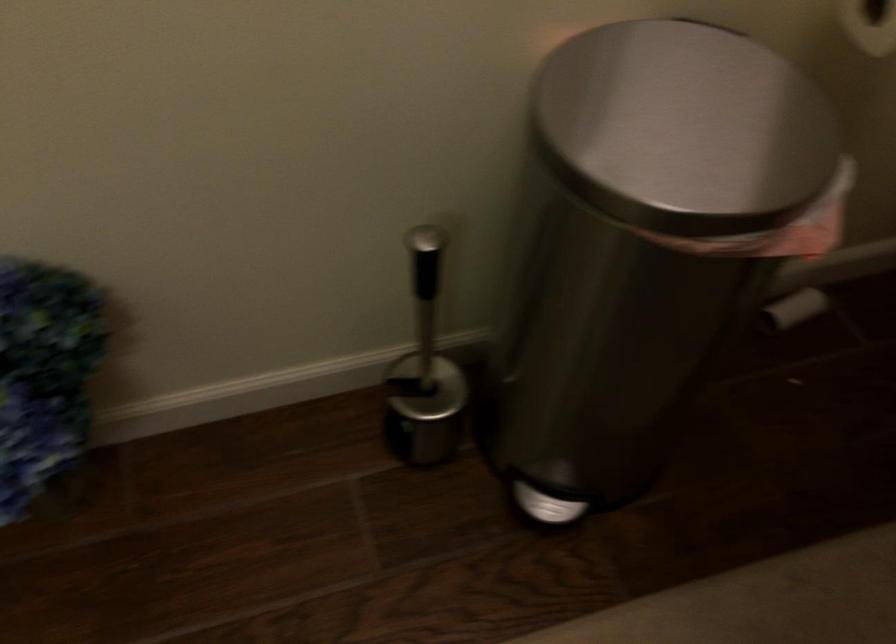
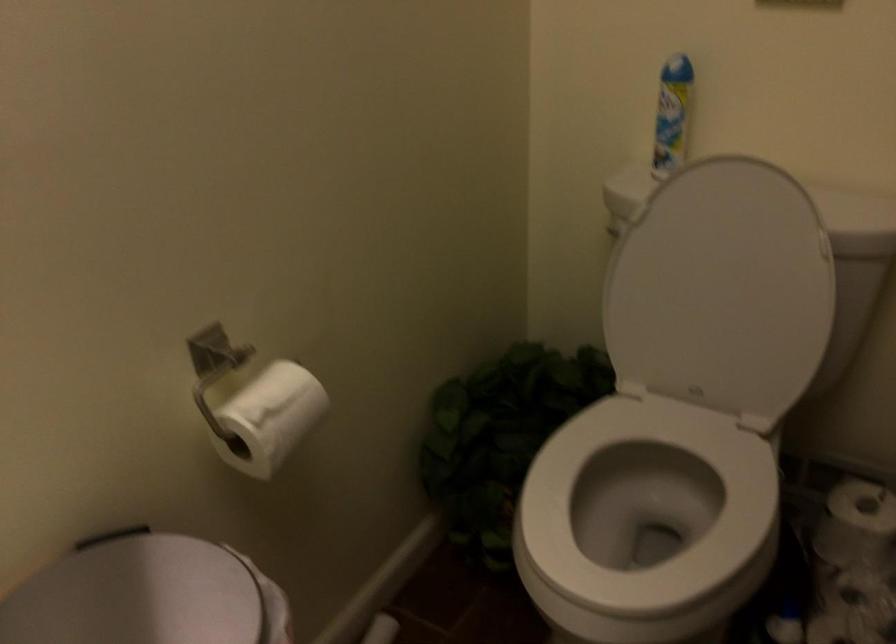
In the second image, find the point that corresponds to [702,90] in the first image.

(138, 594)